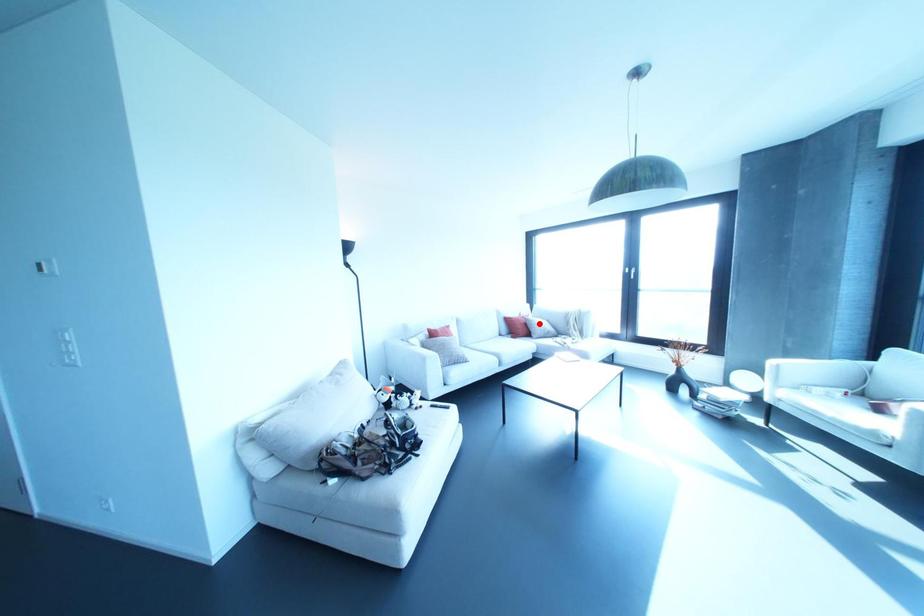
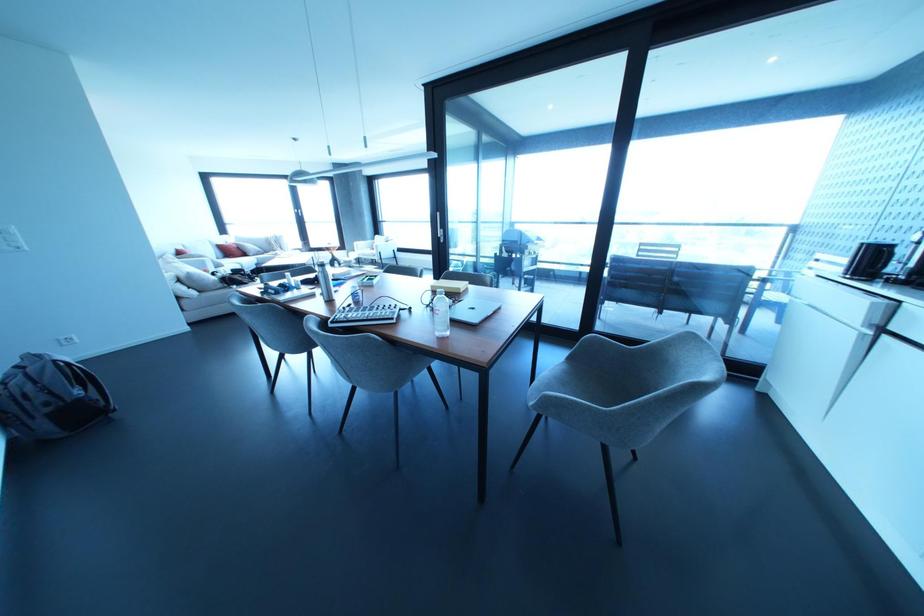
The point at the highlighted location is marked in the first image. Where is the corresponding point in the second image?

(249, 246)